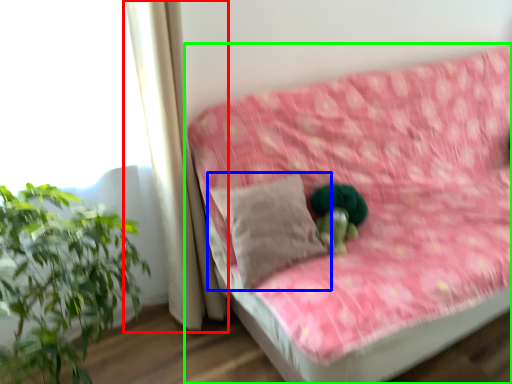
Question: Which object is positioned closest to curtain (highlighted by a red box)? Select from pillow (highlighted by a blue box) and studio couch (highlighted by a green box).

Choices:
 (A) pillow
 (B) studio couch

Answer: (A)